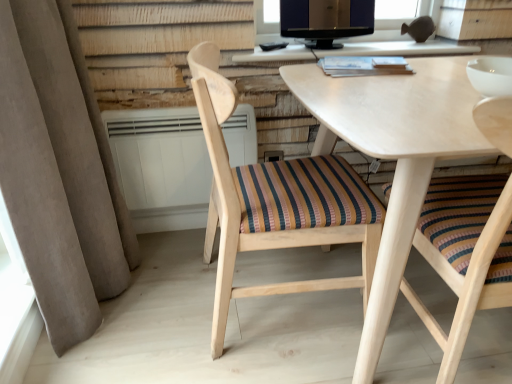
Locate an element on the screen. This screenshot has width=512, height=384. beige fabric curtain at left is located at coordinates (78, 142).

Describe the element at coordinates (161, 166) in the screenshot. This screenshot has width=512, height=384. I see `white plastic radiator at center` at that location.

I want to click on white plastic radiator at center, so click(x=161, y=166).

The height and width of the screenshot is (384, 512). Describe the element at coordinates (326, 20) in the screenshot. I see `matte black monitor at upper center` at that location.

This screenshot has height=384, width=512. Identify the location of wooden chair with striped cushion at center, the 2th chair viewed from the right. (266, 206).

Where is `table above the wooden chair with striped cushion at center, which is the first chair in right-to-left order (from the image's perspective)`? table above the wooden chair with striped cushion at center, which is the first chair in right-to-left order (from the image's perspective) is located at coordinates (357, 51).

Between wooden chair with striped cushion at center, which appears as the 2th chair when viewed from the left, and light wood table at upper center, which one has smaller width?

light wood table at upper center is thinner.

Considering the positions of objects wooden chair with striped cushion at center, which appears as the 2th chair when viewed from the left, and light wood table at upper center in the image provided, who is behind, wooden chair with striped cushion at center, which appears as the 2th chair when viewed from the left, or light wood table at upper center?

light wood table at upper center is further away from the camera.

Between white plastic radiator at center and light wood table at upper center, which one is positioned in front?

Positioned in front is white plastic radiator at center.

Which is nearer, (191, 204) or (354, 53)?

The point (354, 53) is more forward.

Is white plastic radiator at center with light wood table at upper center?

No, white plastic radiator at center is not making contact with light wood table at upper center.

From the image's perspective, which is below, white plastic radiator at center or light wood table at upper center?

white plastic radiator at center.

From the image's perspective, is beige fabric curtain at left under matte black monitor at upper center?

Yes, from the image's perspective, beige fabric curtain at left is beneath matte black monitor at upper center.

Which object is positioned more to the right, beige fabric curtain at left or matte black monitor at upper center?

Positioned to the right is matte black monitor at upper center.

In the image, there is a matte black monitor at upper center. Where is `curtain below it (from a real-world perspective)`? curtain below it (from a real-world perspective) is located at coordinates click(x=78, y=142).

How far apart are wooden chair with striped cushion at center, the 2th chair viewed from the right, and matte black monitor at upper center?

A distance of 29.01 inches exists between wooden chair with striped cushion at center, the 2th chair viewed from the right, and matte black monitor at upper center.

Which object is wider, wooden chair with striped cushion at center, positioned as the first chair in left-to-right order, or matte black monitor at upper center?

wooden chair with striped cushion at center, positioned as the first chair in left-to-right order, is wider.

The image size is (512, 384). I want to click on computer monitor behind the wooden chair with striped cushion at center, positioned as the first chair in left-to-right order, so click(x=326, y=20).

From a real-world perspective, between wooden chair with striped cushion at center, the 2th chair viewed from the right, and matte black monitor at upper center, who is vertically higher?

matte black monitor at upper center, from a real-world perspective.

Does wooden chair with striped cushion at center, positioned as the first chair in left-to-right order, appear on the right side of wooden chair with striped cushion at center, which appears as the 2th chair when viewed from the left?

No, wooden chair with striped cushion at center, positioned as the first chair in left-to-right order, is not to the right of wooden chair with striped cushion at center, which appears as the 2th chair when viewed from the left.

Where is `chair lying in front of the wooden chair with striped cushion at center, the 2th chair viewed from the right`? The height and width of the screenshot is (384, 512). chair lying in front of the wooden chair with striped cushion at center, the 2th chair viewed from the right is located at coordinates (466, 281).

From the image's perspective, between wooden chair with striped cushion at center, the 2th chair viewed from the right, and wooden chair with striped cushion at center, which appears as the 2th chair when viewed from the left, which one is located above?

wooden chair with striped cushion at center, the 2th chair viewed from the right, is shown above in the image.

Who is bigger, beige fabric curtain at left or white plastic radiator at center?

Bigger between the two is beige fabric curtain at left.

Looking at this image, how far apart are beige fabric curtain at left and white plastic radiator at center?

12.25 inches.

Is beige fabric curtain at left positioned behind white plastic radiator at center?

No.

Considering the positions of point (105, 212) and point (158, 125), is point (105, 212) closer or farther from the camera than point (158, 125)?

Point (105, 212) is closer to the camera than point (158, 125).

Are light wood table at upper center and wooden chair with striped cushion at center, positioned as the first chair in left-to-right order, making contact?

They are not placed beside each other.

Is light wood table at upper center not within wooden chair with striped cushion at center, positioned as the first chair in left-to-right order?

Indeed, light wood table at upper center is completely outside wooden chair with striped cushion at center, positioned as the first chair in left-to-right order.

Considering the positions of objects light wood table at upper center and wooden chair with striped cushion at center, the 2th chair viewed from the right, in the image provided, who is in front, light wood table at upper center or wooden chair with striped cushion at center, the 2th chair viewed from the right,?

Positioned in front is wooden chair with striped cushion at center, the 2th chair viewed from the right.

The height and width of the screenshot is (384, 512). In order to click on table lying above the wooden chair with striped cushion at center, which appears as the 2th chair when viewed from the left (from the image's perspective) in this screenshot , I will do click(357, 51).

Locate an element on the screen. Image resolution: width=512 pixels, height=384 pixels. table above the white plastic radiator at center (from a real-world perspective) is located at coordinates coord(357,51).

Considering their positions, is light wood table at upper center positioned closer to matte black monitor at upper center than white plastic radiator at center?

A: Based on the image, light wood table at upper center appears to be nearer to matte black monitor at upper center.

Looking at this image, estimate the real-world distances between objects in this image. Which object is further from white plastic radiator at center, wooden chair with striped cushion at center, which is the first chair in right-to-left order, or light wood table at upper center?

wooden chair with striped cushion at center, which is the first chair in right-to-left order.

Considering their positions, is wooden chair with striped cushion at center, which is the first chair in right-to-left order, positioned further to wooden chair with striped cushion at center, the 2th chair viewed from the right, than beige fabric curtain at left?

beige fabric curtain at left is positioned further to the anchor wooden chair with striped cushion at center, the 2th chair viewed from the right.

When comparing their distances from matte black monitor at upper center, does beige fabric curtain at left or light wood table at upper center seem further?

Based on the image, beige fabric curtain at left appears to be further to matte black monitor at upper center.

Considering their positions, is white plastic radiator at center positioned closer to wooden chair with striped cushion at center, positioned as the first chair in left-to-right order, than beige fabric curtain at left?

white plastic radiator at center lies closer to wooden chair with striped cushion at center, positioned as the first chair in left-to-right order, than the other object.

Based on their spatial positions, is wooden chair with striped cushion at center, which is the first chair in right-to-left order, or white plastic radiator at center further from light wood table at upper center?

The object further to light wood table at upper center is wooden chair with striped cushion at center, which is the first chair in right-to-left order.

Which object lies nearer to the anchor point wooden chair with striped cushion at center, which appears as the 2th chair when viewed from the left, white plastic radiator at center or beige fabric curtain at left?

Based on the image, white plastic radiator at center appears to be nearer to wooden chair with striped cushion at center, which appears as the 2th chair when viewed from the left.

Looking at the image, which one is located closer to light wood table at upper center, white plastic radiator at center or matte black monitor at upper center?

matte black monitor at upper center.

What are the coordinates of `chair situated between beige fabric curtain at left and matte black monitor at upper center from left to right` in the screenshot? It's located at coord(266,206).

You are a GUI agent. You are given a task and a screenshot of the screen. Output one action in this format:
    pyautogui.click(x=<x>, y=<y>)
    Task: Click on the chair between beige fabric curtain at left and light wood table at upper center
    Image resolution: width=512 pixels, height=384 pixels.
    Given the screenshot: What is the action you would take?
    pyautogui.click(x=266, y=206)

The height and width of the screenshot is (384, 512). Find the location of `computer monitor between beige fabric curtain at left and wooden chair with striped cushion at center, which appears as the 2th chair when viewed from the left, from left to right`. computer monitor between beige fabric curtain at left and wooden chair with striped cushion at center, which appears as the 2th chair when viewed from the left, from left to right is located at coordinates (326, 20).

Locate an element on the screen. The width and height of the screenshot is (512, 384). radiator positioned between wooden chair with striped cushion at center, positioned as the first chair in left-to-right order, and matte black monitor at upper center from near to far is located at coordinates (161, 166).